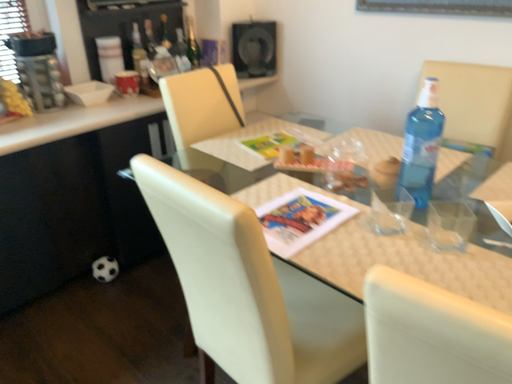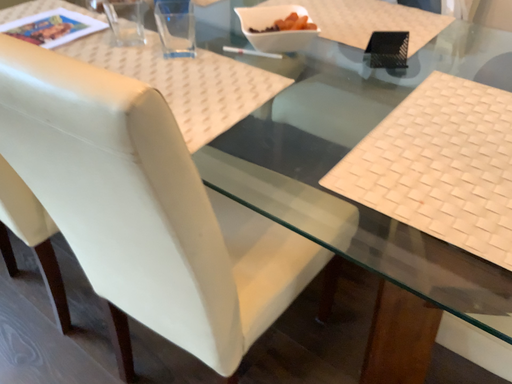
Question: Which way did the camera rotate in the video?

Choices:
 (A) rotated left
 (B) rotated right

Answer: (B)